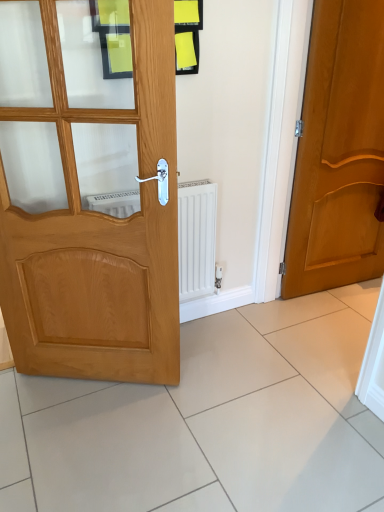
In order to face white glossy tile at lower right, should I rotate leftwards or rightwards?

You should look right and rotate roughly 22.781 degrees.

What is the approximate height of light brown wood door at left, the first door viewed from the left?

It is 1.51 meters.

Describe the element at coordinates (339, 152) in the screenshot. I see `matte wood door at right, marked as the 2th door in a front-to-back arrangement` at that location.

Measure the distance between point [327,48] and camera.

The depth of point [327,48] is 6.31 feet.

Locate an element on the screen. Image resolution: width=384 pixels, height=512 pixels. white glossy tile at lower right is located at coordinates pyautogui.click(x=327, y=353).

Is white glossy tile at lower right taller than matte wood door at right, which is counted as the 1th door, starting from the right?

Incorrect, the height of white glossy tile at lower right is not larger of that of matte wood door at right, which is counted as the 1th door, starting from the right.

From a real-world perspective, is white glossy tile at lower right over matte wood door at right, which is counted as the 1th door, starting from the right?

No, from a real-world perspective, white glossy tile at lower right is not on top of matte wood door at right, which is counted as the 1th door, starting from the right.

Is the position of white glossy tile at lower right more distant than that of matte wood door at right, which is counted as the 1th door, starting from the right?

Yes, white glossy tile at lower right is behind matte wood door at right, which is counted as the 1th door, starting from the right.

Can you confirm if white glossy tile at lower right is positioned to the right of matte wood door at right, marked as the 2th door in a front-to-back arrangement?

Correct, you'll find white glossy tile at lower right to the right of matte wood door at right, marked as the 2th door in a front-to-back arrangement.

Which of these two, white glossy tile at lower right or light brown wood door at left, which ranks as the second door in back-to-front order, is bigger?

light brown wood door at left, which ranks as the second door in back-to-front order.

From a real-world perspective, which object rests below the other?

white glossy tile at lower right, from a real-world perspective.

Can you tell me how much white glossy tile at lower right and light brown wood door at left, which is the 1th door from front to back, differ in facing direction?

The angle between the facing direction of white glossy tile at lower right and the facing direction of light brown wood door at left, which is the 1th door from front to back, is 60.1 degrees.

Which is more to the left, white glossy tile at lower right or light brown wood door at left, which is the 1th door from front to back?

From the viewer's perspective, light brown wood door at left, which is the 1th door from front to back, appears more on the left side.

Could you tell me if light brown wood door at left, which ranks as the second door in back-to-front order, is facing matte wood door at right, acting as the 1th door starting from the back?

No, light brown wood door at left, which ranks as the second door in back-to-front order, is not turned towards matte wood door at right, acting as the 1th door starting from the back.

From a real-world perspective, is light brown wood door at left, the first door viewed from the left, positioned under matte wood door at right, marked as the 2th door in a front-to-back arrangement, based on gravity?

Yes.

Considering the relative sizes of light brown wood door at left, placed as the second door when sorted from right to left, and matte wood door at right, acting as the 1th door starting from the back, in the image provided, is light brown wood door at left, placed as the second door when sorted from right to left, smaller than matte wood door at right, acting as the 1th door starting from the back,?

Yes, light brown wood door at left, placed as the second door when sorted from right to left, is smaller than matte wood door at right, acting as the 1th door starting from the back.

From the image's perspective, is light brown wood door at left, which is the 1th door from front to back, below matte wood door at right, which is counted as the second door, starting from the left?

Yes, from the image's perspective, light brown wood door at left, which is the 1th door from front to back, is beneath matte wood door at right, which is counted as the second door, starting from the left.

Does matte wood door at right, which is counted as the 1th door, starting from the right, have a larger size compared to white glossy tile at lower right?

Indeed, matte wood door at right, which is counted as the 1th door, starting from the right, has a larger size compared to white glossy tile at lower right.

From the image's perspective, is matte wood door at right, acting as the 1th door starting from the back, over white glossy tile at lower right?

Yes, from the image's perspective, matte wood door at right, acting as the 1th door starting from the back, is above white glossy tile at lower right.

Considering the sizes of matte wood door at right, acting as the 1th door starting from the back, and white glossy tile at lower right in the image, is matte wood door at right, acting as the 1th door starting from the back, wider or thinner than white glossy tile at lower right?

matte wood door at right, acting as the 1th door starting from the back, is thinner than white glossy tile at lower right.

Is white glossy tile at lower right inside matte wood door at right, which is counted as the 1th door, starting from the right?

No, white glossy tile at lower right is located outside of matte wood door at right, which is counted as the 1th door, starting from the right.

Locate an element on the screen. ceramic tile below the light brown wood door at left, which is the 1th door from front to back (from the image's perspective) is located at coordinates (327, 353).

From a real-world perspective, who is located lower, light brown wood door at left, placed as the second door when sorted from right to left, or white glossy tile at lower right?

In real-world perspective, white glossy tile at lower right is lower.

Is point (94, 303) less distant than point (348, 396)?

Yes.

Consider the image. Is the position of light brown wood door at left, the first door viewed from the left, less distant than that of white glossy tile at lower right?

Yes, light brown wood door at left, the first door viewed from the left, is closer to the camera.

Is matte wood door at right, which is counted as the 1th door, starting from the right, positioned before light brown wood door at left, the first door viewed from the left?

No, the depth of matte wood door at right, which is counted as the 1th door, starting from the right, is greater than that of light brown wood door at left, the first door viewed from the left.

From the image's perspective, does matte wood door at right, marked as the 2th door in a front-to-back arrangement, appear higher than light brown wood door at left, which ranks as the second door in back-to-front order?

Correct, matte wood door at right, marked as the 2th door in a front-to-back arrangement, appears higher than light brown wood door at left, which ranks as the second door in back-to-front order, in the image.

Considering the sizes of objects matte wood door at right, which is counted as the second door, starting from the left, and light brown wood door at left, placed as the second door when sorted from right to left, in the image provided, who is wider, matte wood door at right, which is counted as the second door, starting from the left, or light brown wood door at left, placed as the second door when sorted from right to left,?

matte wood door at right, which is counted as the second door, starting from the left, is wider.

Consider the image. Which of these two, matte wood door at right, which is counted as the 1th door, starting from the right, or light brown wood door at left, placed as the second door when sorted from right to left, stands taller?

With more height is matte wood door at right, which is counted as the 1th door, starting from the right.

Find the location of a particular element. ceramic tile behind the matte wood door at right, marked as the 2th door in a front-to-back arrangement is located at coordinates (327, 353).

At what (x,y) coordinates should I click in order to perform the action: click on ceramic tile on the right side of light brown wood door at left, placed as the second door when sorted from right to left. Please return your answer as a coordinate pair (x, y). This screenshot has width=384, height=512. Looking at the image, I should click on (327, 353).

When comparing their distances from light brown wood door at left, placed as the second door when sorted from right to left, does white glossy tile at lower right or matte wood door at right, which is counted as the 1th door, starting from the right, seem further?

matte wood door at right, which is counted as the 1th door, starting from the right, is further to light brown wood door at left, placed as the second door when sorted from right to left.

Which object lies nearer to the anchor point white glossy tile at lower right, light brown wood door at left, the first door viewed from the left, or matte wood door at right, which is counted as the second door, starting from the left?

matte wood door at right, which is counted as the second door, starting from the left.

Estimate the real-world distances between objects in this image. Which object is closer to light brown wood door at left, which ranks as the second door in back-to-front order, matte wood door at right, acting as the 1th door starting from the back, or white glossy tile at lower right?

The object closer to light brown wood door at left, which ranks as the second door in back-to-front order, is white glossy tile at lower right.

Estimate the real-world distances between objects in this image. Which object is closer to white glossy tile at lower right, matte wood door at right, acting as the 1th door starting from the back, or light brown wood door at left, which is the 1th door from front to back?

Based on the image, matte wood door at right, acting as the 1th door starting from the back, appears to be nearer to white glossy tile at lower right.

Estimate the real-world distances between objects in this image. Which object is closer to matte wood door at right, marked as the 2th door in a front-to-back arrangement, light brown wood door at left, placed as the second door when sorted from right to left, or white glossy tile at lower right?

white glossy tile at lower right.

Estimate the real-world distances between objects in this image. Which object is further from matte wood door at right, marked as the 2th door in a front-to-back arrangement, white glossy tile at lower right or light brown wood door at left, the first door viewed from the left?

The object further to matte wood door at right, marked as the 2th door in a front-to-back arrangement, is light brown wood door at left, the first door viewed from the left.

Locate an element on the screen. The height and width of the screenshot is (512, 384). door between light brown wood door at left, placed as the second door when sorted from right to left, and white glossy tile at lower right is located at coordinates (339, 152).